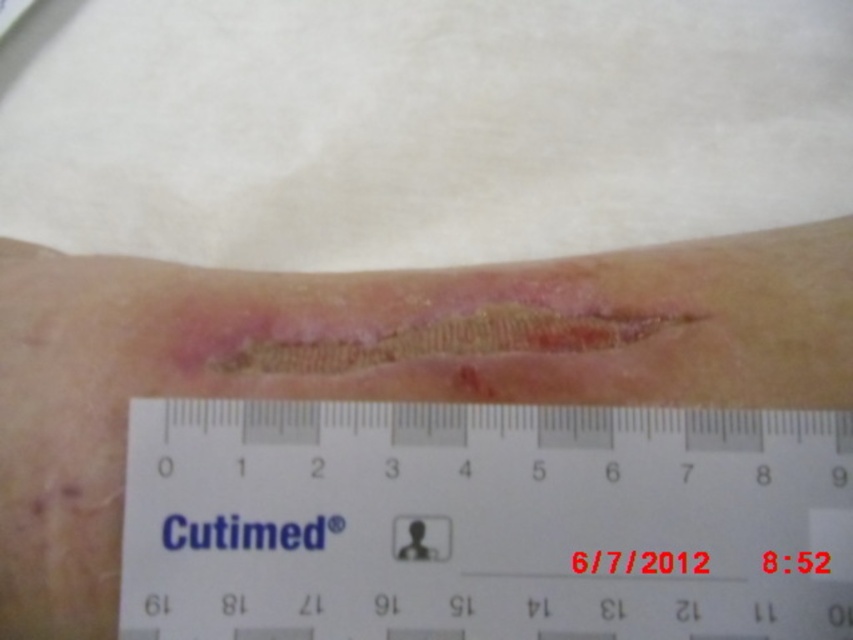
Question: Which point is farther to the camera?

Choices:
 (A) white paper ruler at center
 (B) dry scabbed skin at center

Answer: (B)

Question: Can you confirm if white paper ruler at center is positioned below dry scabbed skin at center?

Choices:
 (A) yes
 (B) no

Answer: (A)

Question: Is white paper ruler at center smaller than dry scabbed skin at center?

Choices:
 (A) no
 (B) yes

Answer: (B)

Question: Which object appears closest to the camera in this image?

Choices:
 (A) white paper ruler at center
 (B) dry scabbed skin at center

Answer: (A)

Question: Is white paper ruler at center below dry scabbed skin at center?

Choices:
 (A) yes
 (B) no

Answer: (A)